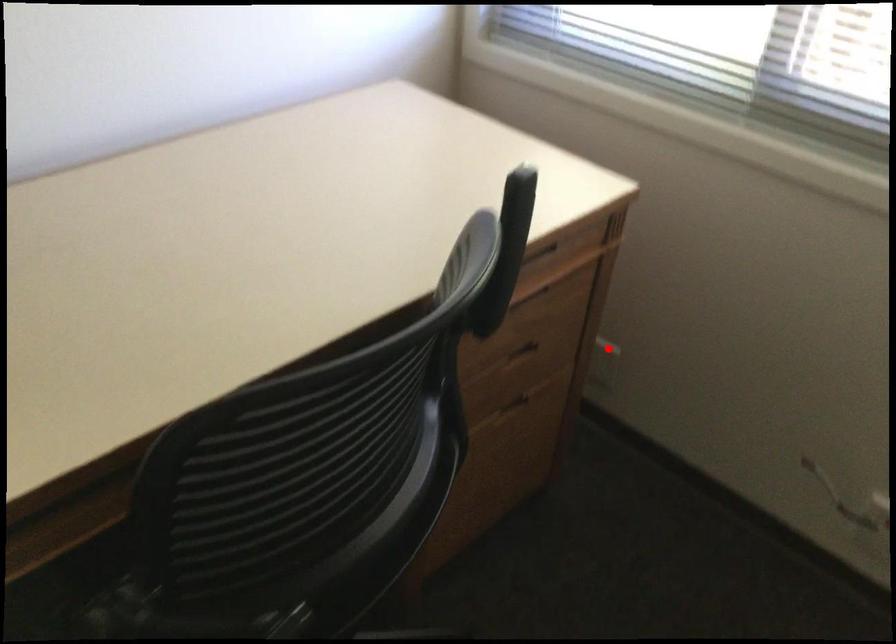
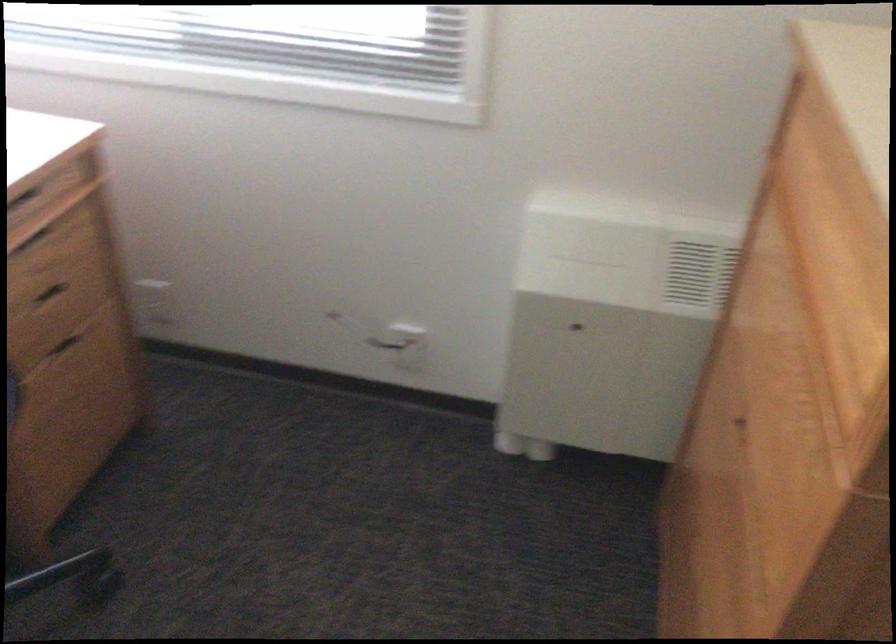
In the second image, find the point that corresponds to the highlighted location in the first image.

(153, 299)